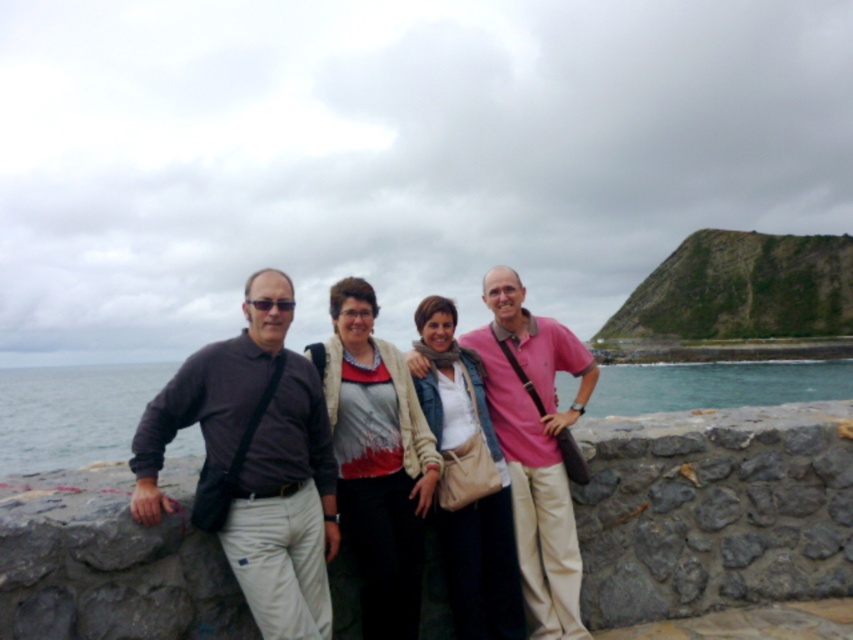
Which of these two, dark gray shirt at center or matte red sweater at center, stands shorter?

dark gray shirt at center is shorter.

Does dark gray shirt at center have a smaller size compared to matte red sweater at center?

No, dark gray shirt at center is not smaller than matte red sweater at center.

Where is `dark gray shirt at center`? This screenshot has width=853, height=640. dark gray shirt at center is located at coordinates (254, 461).

Does matte gray shirt at center appear on the left side of pink cotton shirt at center?

Correct, you'll find matte gray shirt at center to the left of pink cotton shirt at center.

Who is more distant from viewer, (234, 371) or (560, 620)?

Point (560, 620)

You are a GUI agent. You are given a task and a screenshot of the screen. Output one action in this format:
    pyautogui.click(x=<x>, y=<y>)
    Task: Click on the matte gray shirt at center
    
    Given the screenshot: What is the action you would take?
    pyautogui.click(x=317, y=456)

Can you confirm if blue water at lower left is bigger than pink cotton shirt at center?

Yes, blue water at lower left is bigger than pink cotton shirt at center.

Is blue water at lower left thinner than pink cotton shirt at center?

No, blue water at lower left is not thinner than pink cotton shirt at center.

Does point (141, 378) come in front of point (502, 435)?

No, it is not.

Locate an element on the screen. This screenshot has height=640, width=853. blue water at lower left is located at coordinates (71, 413).